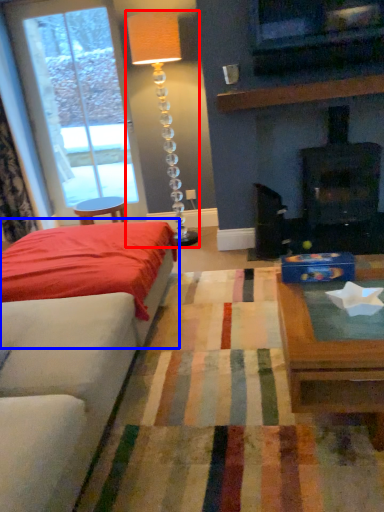
Question: Which of the following is the farthest to the observer, table lamp (highlighted by a red box) or bed (highlighted by a blue box)?

Choices:
 (A) table lamp
 (B) bed

Answer: (A)